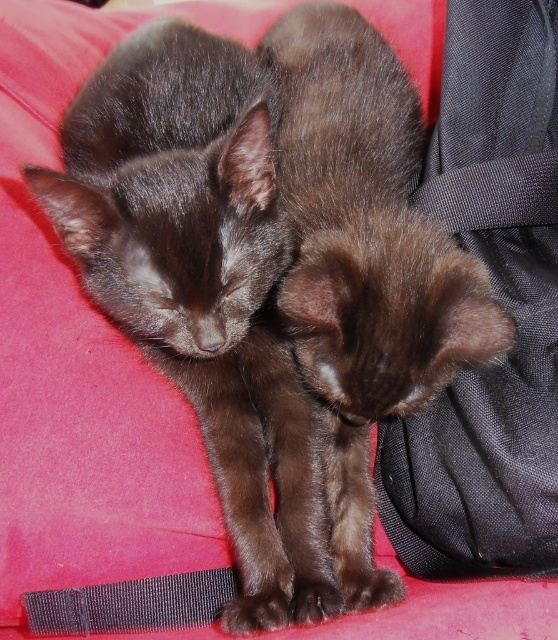
Is shiny brown kitten at center positioned before black textured strap at lower left?

That is True.

Is point (286, 38) positioned behind point (118, 589)?

Yes, point (286, 38) is farther from viewer.

This screenshot has width=558, height=640. What do you see at coordinates (367, 227) in the screenshot? I see `shiny brown kitten at center` at bounding box center [367, 227].

Where is `shiny brown kitten at center`? shiny brown kitten at center is located at coordinates (367, 227).